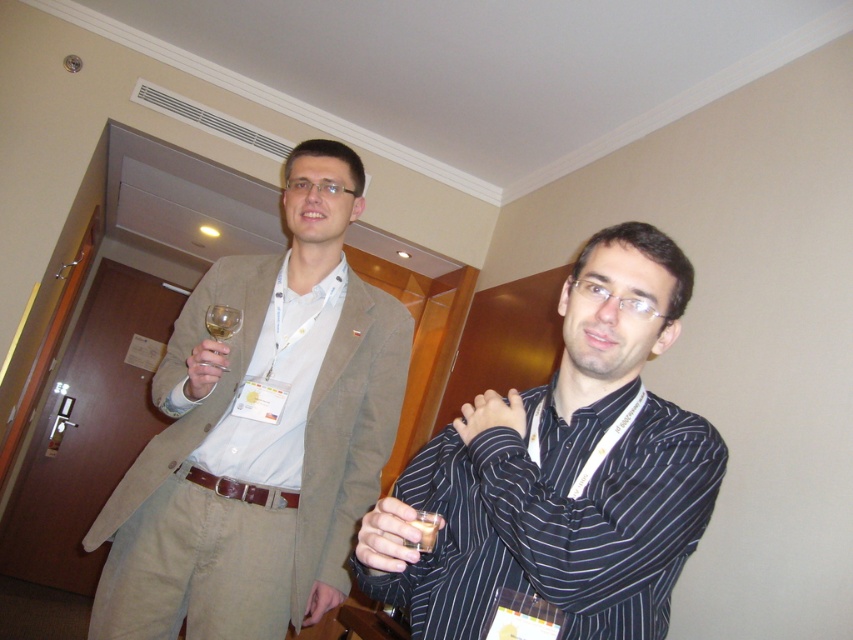
Question: Estimate the real-world distances between objects in this image. Which object is farther from the matte glass wine glass at upper left?

Choices:
 (A) light brown textured blazer at center
 (B) clear glass wine glass at upper left
 (C) translucent glass at center
 (D) black striped shirt at center

Answer: (C)

Question: Which point appears farthest from the camera in this image?

Choices:
 (A) (517, 508)
 (B) (233, 316)

Answer: (B)

Question: Can you confirm if black striped shirt at center is wider than matte glass wine glass at upper left?

Choices:
 (A) no
 (B) yes

Answer: (B)

Question: Is matte glass wine glass at upper left below clear glass wine glass at upper left?

Choices:
 (A) no
 (B) yes

Answer: (B)

Question: Which is farther from the clear glass wine glass at upper left?

Choices:
 (A) light brown textured blazer at center
 (B) black striped shirt at center
 (C) translucent glass at center

Answer: (C)

Question: Is light brown textured blazer at center below black striped shirt at center?

Choices:
 (A) no
 (B) yes

Answer: (A)